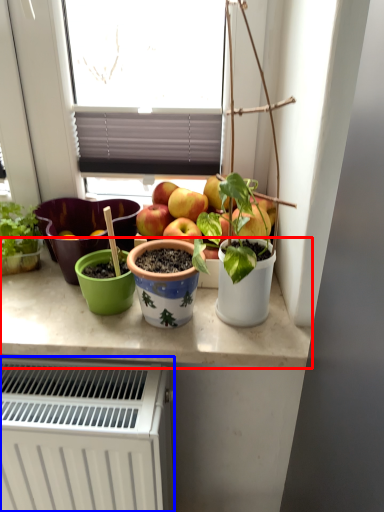
Question: Which of the following is the farthest to the observer, counter top (highlighted by a red box) or radiator (highlighted by a blue box)?

Choices:
 (A) counter top
 (B) radiator

Answer: (A)